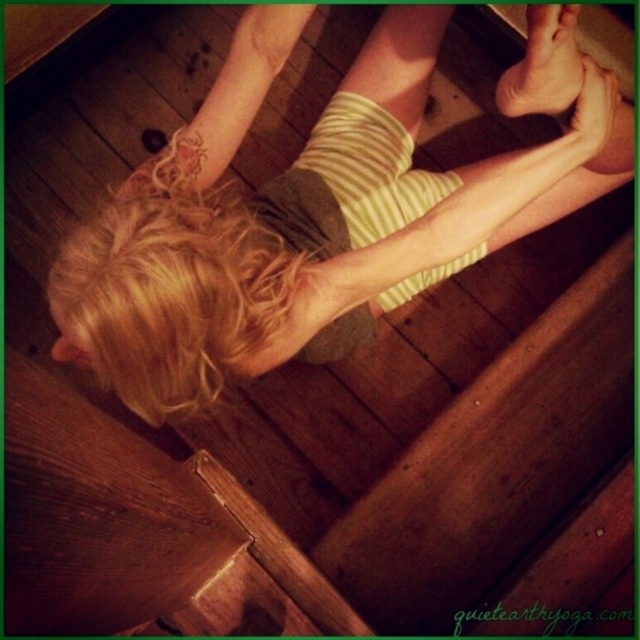
You are a photographer setting up a shoot in the scene described. You need to ensure that the blonde hair at upper center and the smooth skin foot at upper center are both visible in the frame. Given that the frame has a width limit of 1 meter, can both objects fit side by side without overlapping?

The blonde hair at upper center is wider than the smooth skin foot at upper center. However, since the combined width of both objects would depend on their individual measurements, but the exact widths aren

You are a photographer trying to capture the child in a yoga pose. You want to ensure the blonde hair at upper center and smooth skin foot at upper center are both visible in the frame. Based on their positions, which object should appear higher in the photo?

The smooth skin foot at upper center appears higher in the photo because the blonde hair at upper center is located below it.